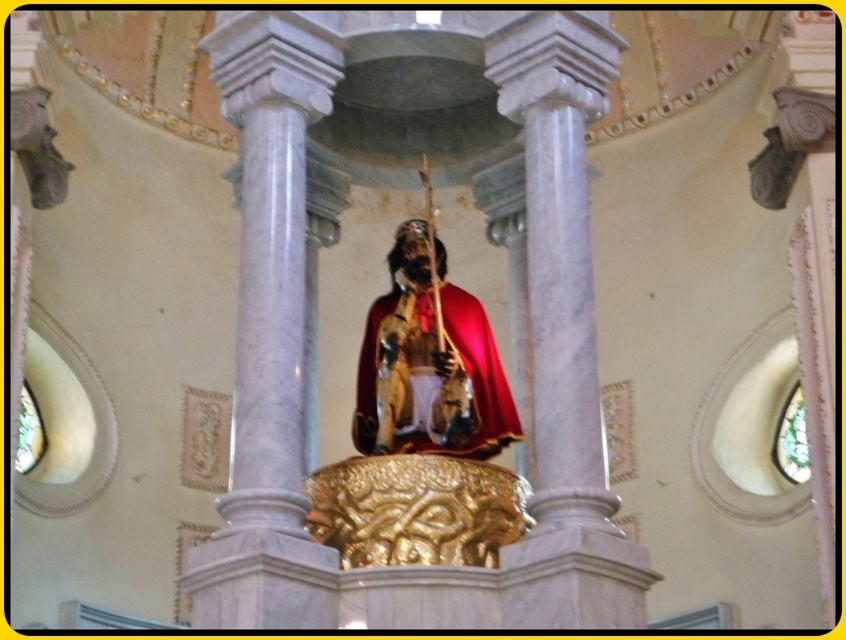
Who is positioned more to the left, gold polished statue at center or shiny gold robe at center?

From the viewer's perspective, shiny gold robe at center appears more on the left side.

Can you confirm if gold polished statue at center is positioned to the left of shiny gold robe at center?

Incorrect, gold polished statue at center is not on the left side of shiny gold robe at center.

Locate an element on the screen. This screenshot has height=640, width=846. gold polished statue at center is located at coordinates (423, 426).